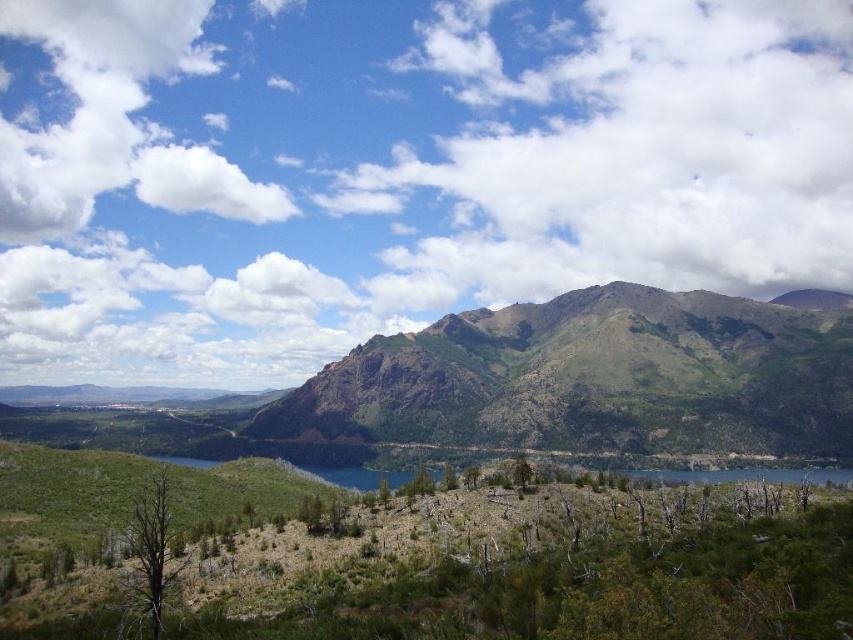
Does point (189, 321) come farther from viewer compared to point (589, 440)?

That is True.

Between point (236, 250) and point (724, 296), which one is positioned behind?

Positioned behind is point (236, 250).

Between point (383, 304) and point (824, 323), which one is positioned behind?

Point (383, 304)

Locate an element on the screen. The height and width of the screenshot is (640, 853). white fluffy cloud at upper center is located at coordinates (402, 170).

Which is below, green textured mountain at center or white fluffy cloud at upper left?

Positioned lower is green textured mountain at center.

Which is behind, point (711, 435) or point (206, 202)?

Positioned behind is point (206, 202).

Locate an element on the screen. The width and height of the screenshot is (853, 640). green textured mountain at center is located at coordinates (596, 376).

Can you confirm if white fluffy cloud at upper center is positioned to the right of white fluffy cloud at upper left?

Correct, you'll find white fluffy cloud at upper center to the right of white fluffy cloud at upper left.

Which is behind, point (657, 112) or point (245, 186)?

Point (657, 112)

Does point (793, 52) come in front of point (239, 168)?

That is False.

This screenshot has height=640, width=853. I want to click on white fluffy cloud at upper center, so click(x=402, y=170).